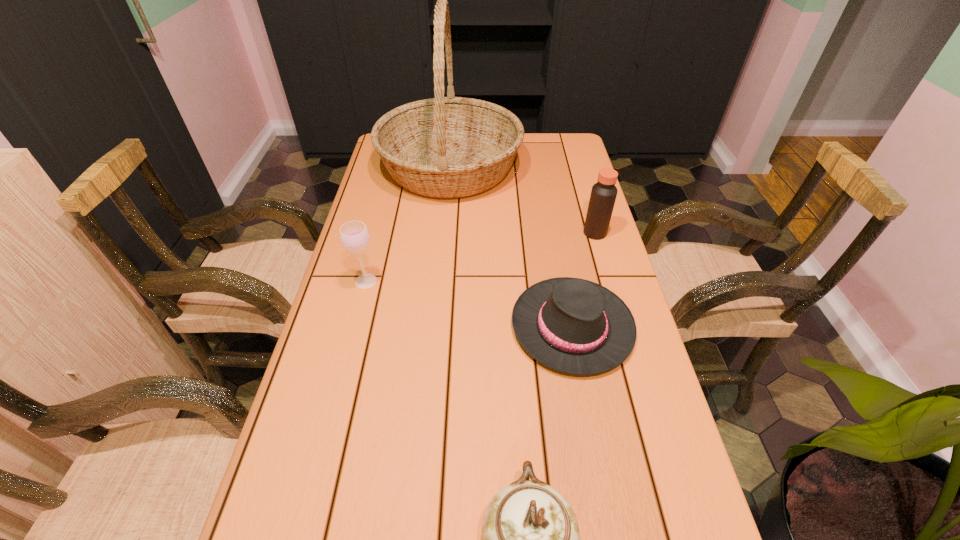
You are a GUI agent. You are given a task and a screenshot of the screen. Output one action in this format:
    pyautogui.click(x=<x>, y=<y>)
    Task: Click on the basket
    
    Given the screenshot: What is the action you would take?
    pyautogui.click(x=445, y=147)

At what (x,y) coordinates should I click in order to perform the action: click on the farthest object. Please return your answer as a coordinate pair (x, y). The height and width of the screenshot is (540, 960). Looking at the image, I should click on (445, 147).

This screenshot has width=960, height=540. I want to click on vinegar, so click(603, 194).

Where is `wineglass`? This screenshot has height=540, width=960. wineglass is located at coordinates (354, 236).

Identify the location of dress hat. The width and height of the screenshot is (960, 540). (575, 326).

The image size is (960, 540). Identify the location of vacant space located on the right of the farthest object. (566, 168).

Find the location of a particular element. The width and height of the screenshot is (960, 540). free space located on the left of the vinegar is located at coordinates (480, 233).

Where is `vacant region located on the back of the wineglass`? The image size is (960, 540). vacant region located on the back of the wineglass is located at coordinates (375, 243).

You are a GUI agent. You are given a task and a screenshot of the screen. Output one action in this format:
    pyautogui.click(x=<x>, y=<y>)
    Task: Click on the vacant point located on the front of the shortest object
    The image size is (960, 540).
    Given the screenshot: What is the action you would take?
    pyautogui.click(x=588, y=414)

Locate an element on the screen. object that is at the far edge is located at coordinates (445, 147).